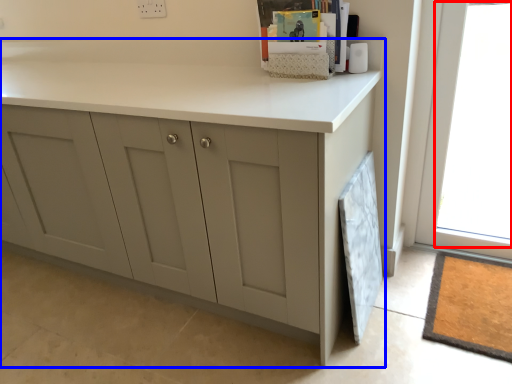
Question: Which object is closer to the camera taking this photo, window (highlighted by a red box) or cabinetry (highlighted by a blue box)?

Choices:
 (A) window
 (B) cabinetry

Answer: (B)